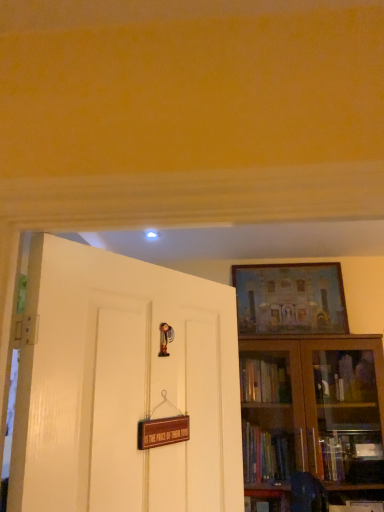
Question: Is brown wooden bookcase at right situated inside matte wooden picture frame at upper right or outside?

Choices:
 (A) inside
 (B) outside

Answer: (B)

Question: Is brown wooden bookcase at right bigger or smaller than matte wooden picture frame at upper right?

Choices:
 (A) small
 (B) big

Answer: (B)

Question: Which is nearer to the matte wooden picture frame at upper right?

Choices:
 (A) brown wooden bookcase at right
 (B) white glossy door at left

Answer: (A)

Question: Estimate the real-world distances between objects in this image. Which object is farther from the matte wooden picture frame at upper right?

Choices:
 (A) brown wooden bookcase at right
 (B) white glossy door at left

Answer: (B)